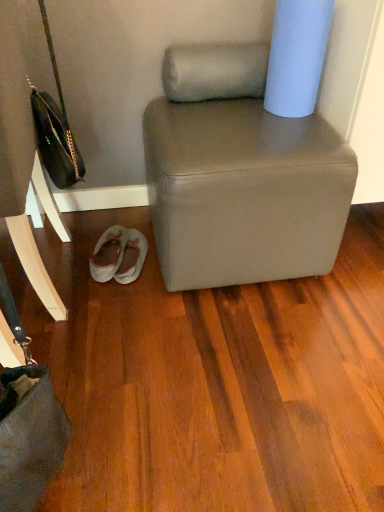
Find the location of `vacant area that is situated to the right of leather handbag at left`. vacant area that is situated to the right of leather handbag at left is located at coordinates (135, 316).